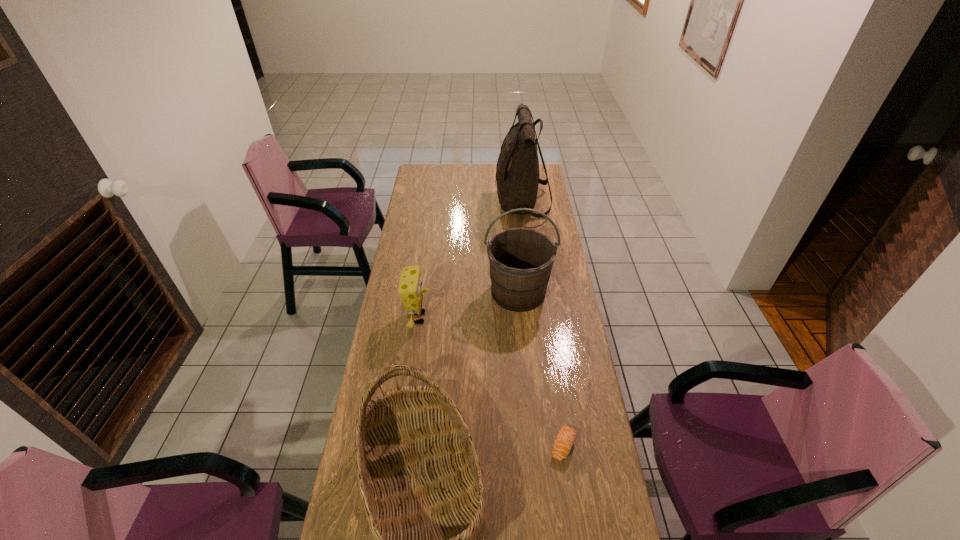
Locate an element on the screen. The height and width of the screenshot is (540, 960). backpack is located at coordinates (517, 172).

This screenshot has width=960, height=540. I want to click on the tallest object, so click(x=517, y=172).

Image resolution: width=960 pixels, height=540 pixels. Find the location of `the fourth shortest object`. the fourth shortest object is located at coordinates (521, 259).

This screenshot has height=540, width=960. I want to click on sponge, so click(410, 290).

Locate an element on the screen. The height and width of the screenshot is (540, 960). the shortest object is located at coordinates click(x=566, y=436).

The height and width of the screenshot is (540, 960). Find the location of `blank space located on the open flap of the backpack`. blank space located on the open flap of the backpack is located at coordinates (426, 203).

Locate an element on the screen. This screenshot has height=540, width=960. vacant point located on the open flap of the backpack is located at coordinates (468, 203).

Locate an element on the screen. Image resolution: width=960 pixels, height=540 pixels. free spot located 0.310m on the open flap of the backpack is located at coordinates (438, 203).

Locate an element on the screen. vacant space situated on the left of the fourth shortest object is located at coordinates (437, 292).

Where is `vacant area situated on the face of the sponge`? vacant area situated on the face of the sponge is located at coordinates (498, 318).